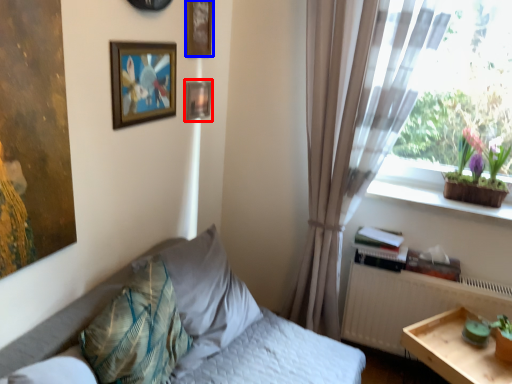
Question: Which object is further to the camera taking this photo, picture frame (highlighted by a red box) or picture frame (highlighted by a blue box)?

Choices:
 (A) picture frame
 (B) picture frame

Answer: (A)